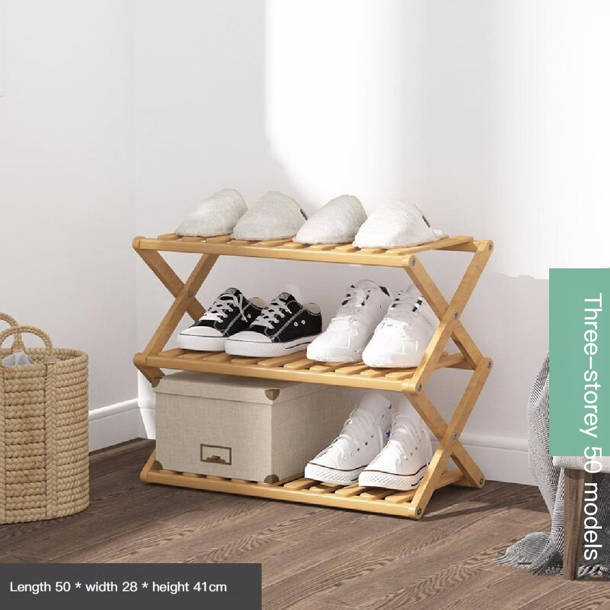
You are a GUI agent. You are given a task and a screenshot of the screen. Output one action in this format:
    pyautogui.click(x=<x>, y=<y>)
    Task: Click on the shoes on shoe rack
    Image resolution: width=610 pixels, height=610 pixels.
    Given the screenshot: What is the action you would take?
    pyautogui.click(x=210, y=220), pyautogui.click(x=257, y=227), pyautogui.click(x=325, y=224), pyautogui.click(x=400, y=232), pyautogui.click(x=393, y=343), pyautogui.click(x=345, y=336), pyautogui.click(x=277, y=324), pyautogui.click(x=202, y=323), pyautogui.click(x=341, y=454), pyautogui.click(x=399, y=454)